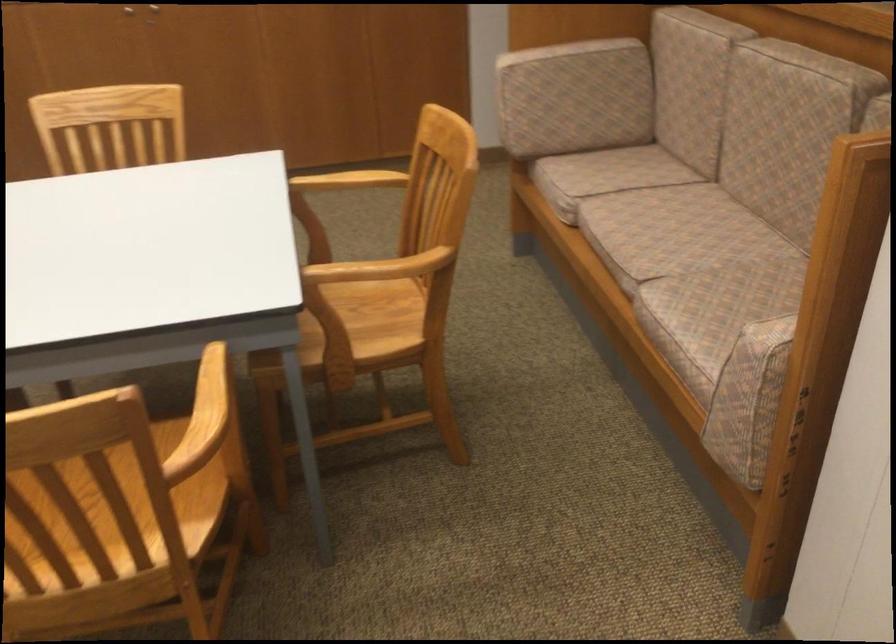
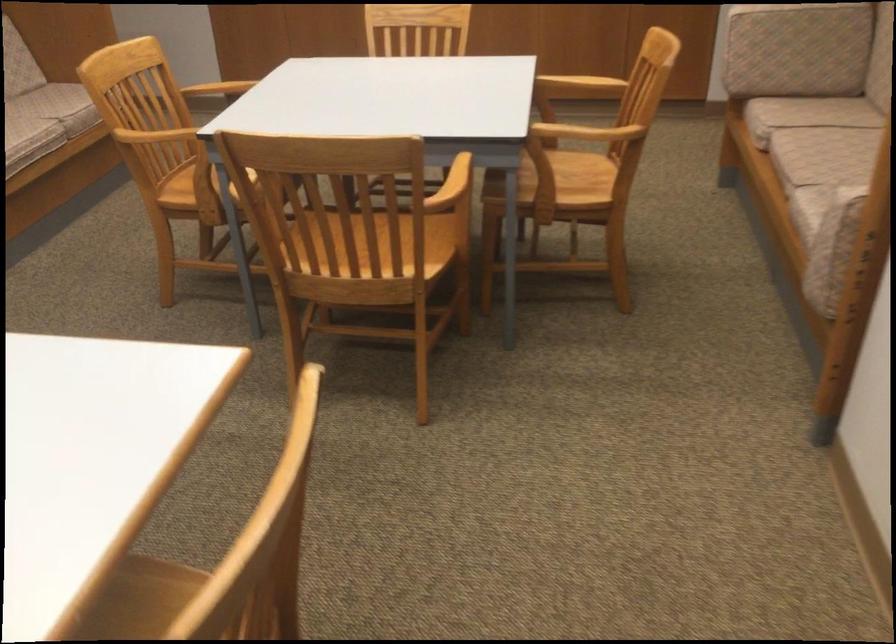
Where in the second image is the point corresponding to the point at 331,152 from the first image?

(580, 84)